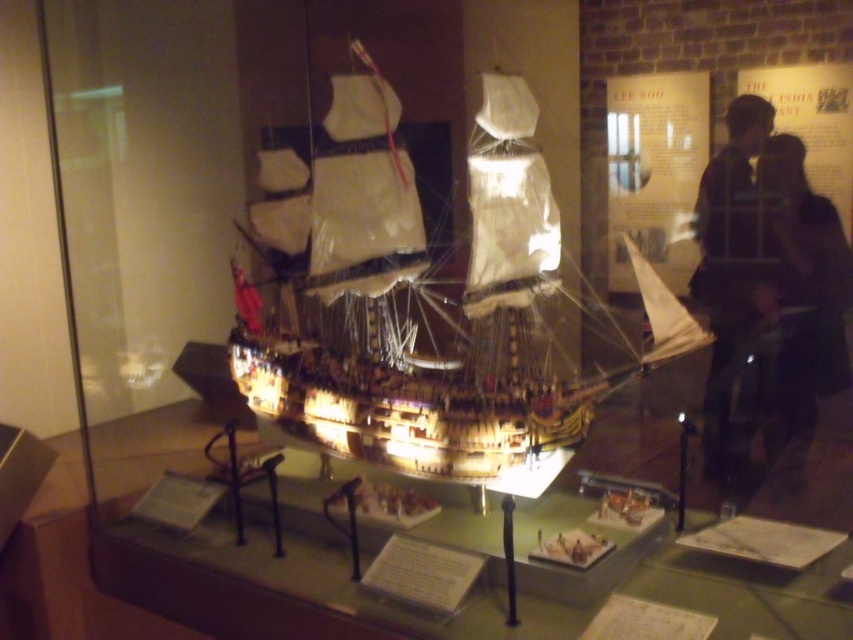
You are a museum visitor standing in front of the glass case. You notice the wooden ship at center and the dark brown leather jacket at right. Which object is positioned closer to the right side of the display?

The dark brown leather jacket at right is positioned closer to the right side of the display because the wooden ship at center is to the left of it.